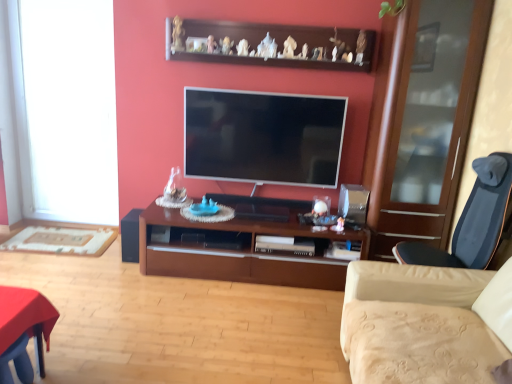
Question: From the image's perspective, is wooden shelf at upper center on top of black matte speaker at lower left?

Choices:
 (A) yes
 (B) no

Answer: (A)

Question: From the image's perspective, does wooden shelf at upper center appear lower than black matte speaker at lower left?

Choices:
 (A) no
 (B) yes

Answer: (A)

Question: Is wooden shelf at upper center aimed at black matte speaker at lower left?

Choices:
 (A) no
 (B) yes

Answer: (A)

Question: Can you confirm if wooden shelf at upper center is bigger than black matte speaker at lower left?

Choices:
 (A) yes
 (B) no

Answer: (A)

Question: Could black matte speaker at lower left be considered to be inside wooden shelf at upper center?

Choices:
 (A) no
 (B) yes

Answer: (A)

Question: In the image, is black matte speaker at lower left on the left side or the right side of brown wood cabinet at center?

Choices:
 (A) left
 (B) right

Answer: (A)

Question: Do you think black matte speaker at lower left is within brown wood cabinet at center, or outside of it?

Choices:
 (A) outside
 (B) inside

Answer: (A)

Question: Considering the positions of black matte speaker at lower left and brown wood cabinet at center in the image, is black matte speaker at lower left bigger or smaller than brown wood cabinet at center?

Choices:
 (A) big
 (B) small

Answer: (B)

Question: Considering the positions of point (131, 218) and point (147, 231), is point (131, 218) closer or farther from the camera than point (147, 231)?

Choices:
 (A) farther
 (B) closer

Answer: (A)

Question: Considering the relative positions of brown wood cabinet at center and flat screen tv at center in the image provided, is brown wood cabinet at center to the left or to the right of flat screen tv at center?

Choices:
 (A) left
 (B) right

Answer: (A)

Question: Is point (287, 200) closer or farther from the camera than point (241, 107)?

Choices:
 (A) farther
 (B) closer

Answer: (A)

Question: In terms of size, does brown wood cabinet at center appear bigger or smaller than flat screen tv at center?

Choices:
 (A) small
 (B) big

Answer: (B)

Question: From a real-world perspective, is brown wood cabinet at center above or below flat screen tv at center?

Choices:
 (A) below
 (B) above

Answer: (A)

Question: Would you say black matte speaker at lower left is to the left or to the right of white glass window at left in the picture?

Choices:
 (A) right
 (B) left

Answer: (A)

Question: From a real-world perspective, is black matte speaker at lower left above or below white glass window at left?

Choices:
 (A) below
 (B) above

Answer: (A)